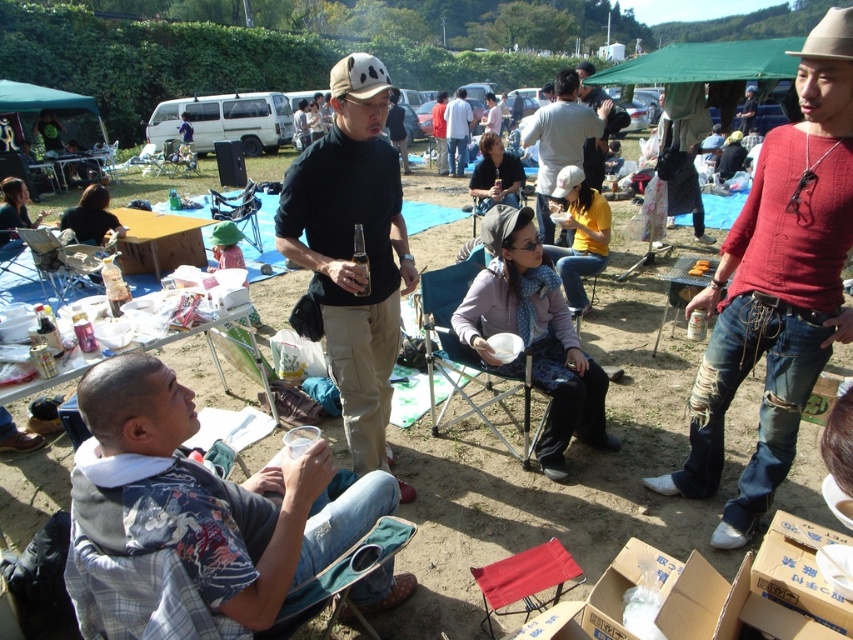
Question: Which object is positioned farthest from the matte black shirt at center?

Choices:
 (A) denim fabric chair at lower left
 (B) panda-patterned fabric cowboy hat at center
 (C) printed cotton shirt at lower left

Answer: (A)

Question: Can you confirm if matte black shirt at center is positioned to the right of denim fabric chair at lower left?

Choices:
 (A) yes
 (B) no

Answer: (A)

Question: Which of these objects is positioned closest to the panda-patterned fabric cowboy hat at center?

Choices:
 (A) yellow cotton shirt at center
 (B) printed cotton shirt at lower left
 (C) matte black jacket at center
 (D) matte black folding chair at center

Answer: (B)

Question: From the image, what is the correct spatial relationship of ripped denim jeans at center in relation to matte black folding chair at center?

Choices:
 (A) above
 (B) below

Answer: (B)

Question: Is yellow cotton shirt at center above matte black jacket at center?

Choices:
 (A) no
 (B) yes

Answer: (A)

Question: Which point is closer to the camera?

Choices:
 (A) panda-patterned fabric cowboy hat at center
 (B) printed cotton shirt at lower left

Answer: (B)